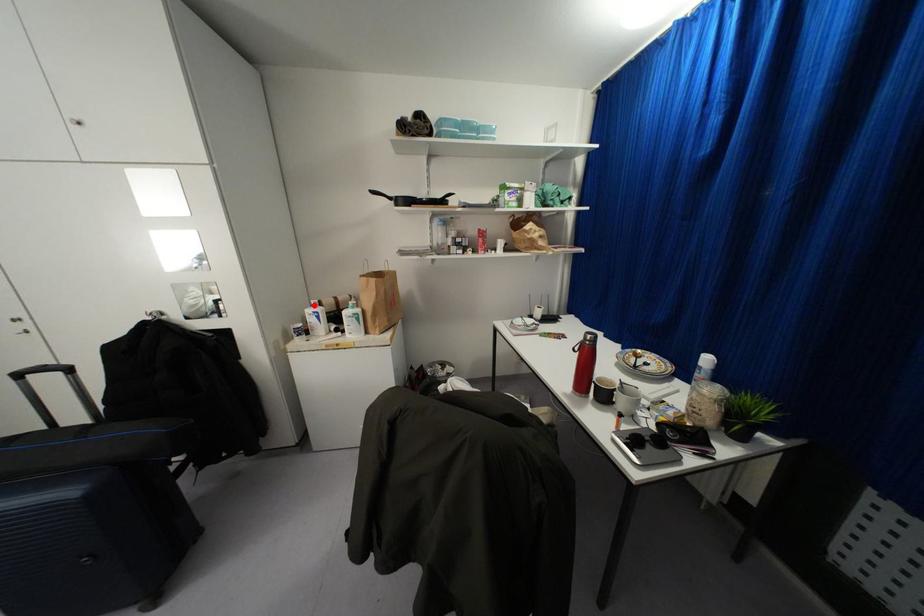
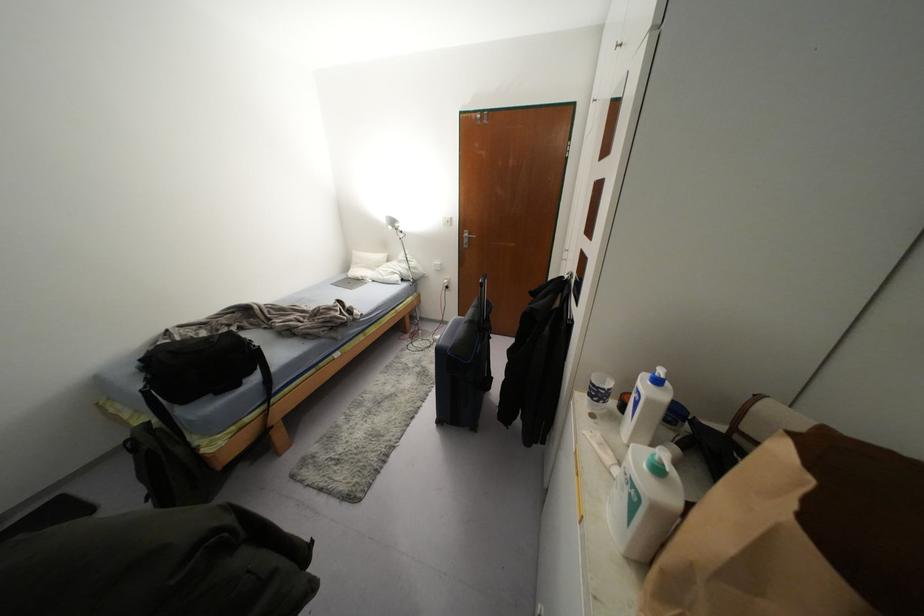
In the second image, find the point that corresponds to the highlighted location in the first image.

(658, 381)